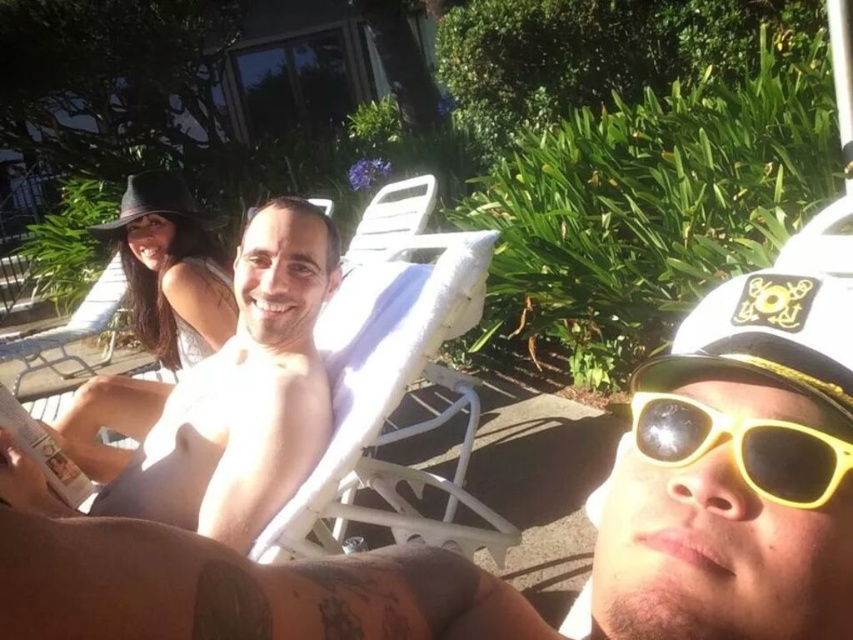
Question: Does smooth white towel at center appear over white plastic beach chair at upper left?

Choices:
 (A) yes
 (B) no

Answer: (A)

Question: Which object is the farthest from the smooth skin man at center?

Choices:
 (A) black felt baseball hat at upper left
 (B) black felt hat at upper left
 (C) white plastic beach chair at upper left

Answer: (C)

Question: Does smooth skin man at center appear on the left side of black felt hat at upper left?

Choices:
 (A) no
 (B) yes

Answer: (A)

Question: Which is nearer to the smooth white towel at center?

Choices:
 (A) black felt baseball hat at upper left
 (B) black felt hat at upper left
 (C) white plastic beach chair at upper left

Answer: (B)

Question: Among these points, which one is nearest to the camera?

Choices:
 (A) (142, 528)
 (B) (165, 212)
 (C) (62, 346)

Answer: (A)

Question: Can you confirm if black felt hat at upper left is bigger than black felt baseball hat at upper left?

Choices:
 (A) yes
 (B) no

Answer: (A)